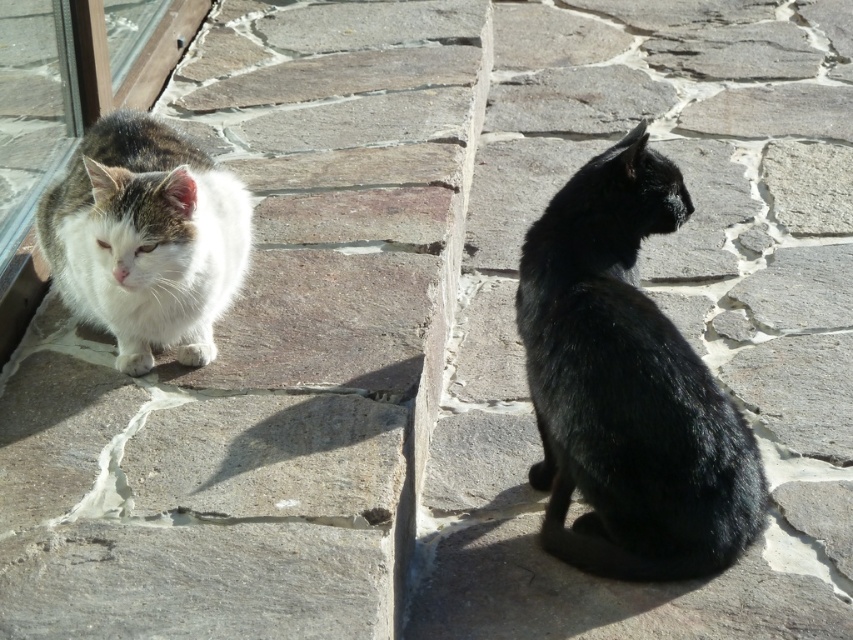
Question: Considering the relative positions of shiny black cat at center and white fluffy cat at left in the image provided, where is shiny black cat at center located with respect to white fluffy cat at left?

Choices:
 (A) below
 (B) above

Answer: (A)

Question: Which object appears closest to the camera in this image?

Choices:
 (A) white fluffy cat at left
 (B) shiny black cat at center

Answer: (A)

Question: Does shiny black cat at center have a smaller size compared to white fluffy cat at left?

Choices:
 (A) no
 (B) yes

Answer: (A)

Question: Among these points, which one is nearest to the camera?

Choices:
 (A) (706, 570)
 (B) (137, 204)

Answer: (B)

Question: Which of the following is the farthest from the observer?

Choices:
 (A) (635, 401)
 (B) (102, 173)

Answer: (A)

Question: Is shiny black cat at center positioned in front of white fluffy cat at left?

Choices:
 (A) no
 (B) yes

Answer: (A)